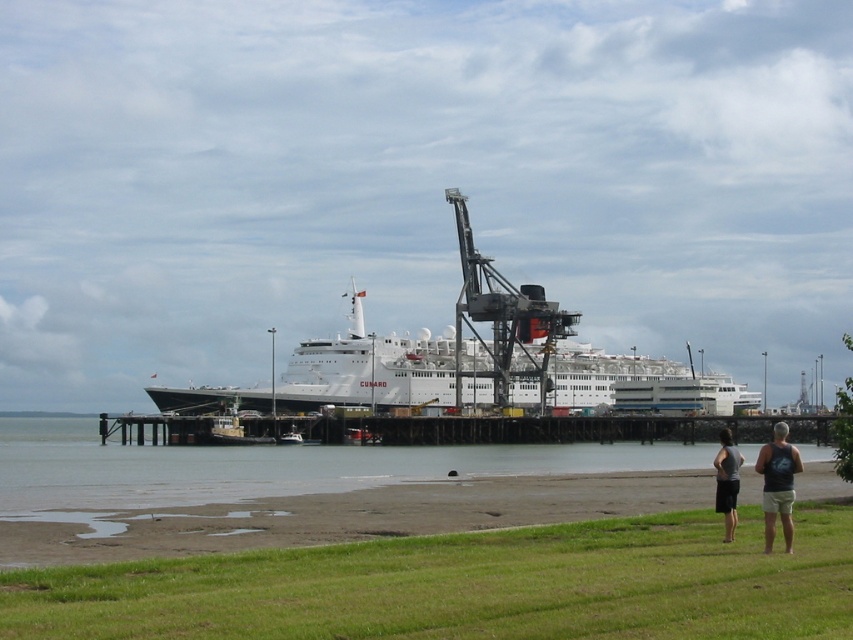
From the picture: Does white glossy cruise ship at center have a larger size compared to wooden dock at center?

Yes.

Does white glossy cruise ship at center have a lesser width compared to wooden dock at center?

No.

Is point (358, 380) closer to camera compared to point (590, 426)?

No, it is behind (590, 426).

You are a GUI agent. You are given a task and a screenshot of the screen. Output one action in this format:
    pyautogui.click(x=<x>, y=<y>)
    Task: Click on the white glossy cruise ship at center
    The height and width of the screenshot is (640, 853).
    Given the screenshot: What is the action you would take?
    pyautogui.click(x=355, y=372)

In the scene shown: Who is more forward, (375, 384) or (724, 458)?

Point (724, 458) is more forward.

Is white glossy cruise ship at center taller than dark gray fabric shorts at lower right?

Yes, white glossy cruise ship at center is taller than dark gray fabric shorts at lower right.

Which is behind, point (640, 362) or point (735, 472)?

Point (640, 362)

At what (x,y) coordinates should I click in order to perform the action: click on white glossy cruise ship at center. Please return your answer as a coordinate pair (x, y). This screenshot has height=640, width=853. Looking at the image, I should click on (355, 372).

Who is lower down, dark gray tank top at lower right or dark gray fabric shorts at lower right?

dark gray fabric shorts at lower right is lower down.

Does dark gray tank top at lower right have a lesser height compared to dark gray fabric shorts at lower right?

No, dark gray tank top at lower right is not shorter than dark gray fabric shorts at lower right.

This screenshot has height=640, width=853. What are the coordinates of `dark gray tank top at lower right` in the screenshot? It's located at (778, 484).